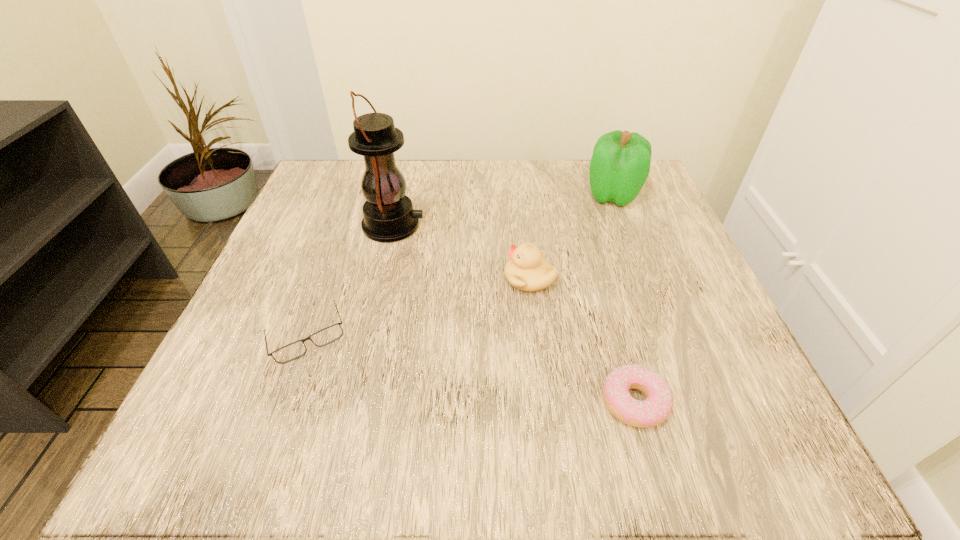
Locate an element on the screen. object that is the second nearest to the third nearest object is located at coordinates (388, 216).

At what (x,y) coordinates should I click in order to perform the action: click on vacant region that satisfies the following two spatial constraints: 1. above the lantern, indicating its light source; 2. with the lenses facing outward on the spectacles. Please return your answer as a coordinate pair (x, y). Image resolution: width=960 pixels, height=540 pixels. Looking at the image, I should click on (368, 336).

At what (x,y) coordinates should I click in order to perform the action: click on free space that satisfies the following two spatial constraints: 1. on the beak of the third nearest object; 2. on the right side of the doughnut. Please return your answer as a coordinate pair (x, y). The image size is (960, 540). Looking at the image, I should click on (543, 402).

Image resolution: width=960 pixels, height=540 pixels. In order to click on free spot that satisfies the following two spatial constraints: 1. above the nearest object, indicating its light source; 2. on the right side of the lantern in this screenshot , I will do `click(352, 402)`.

Identify the location of free space in the image that satisfies the following two spatial constraints: 1. above the lantern, indicating its light source; 2. on the left side of the nearest object. (352, 402).

At what (x,y) coordinates should I click in order to perform the action: click on free spot that satisfies the following two spatial constraints: 1. on the back side of the nearest object; 2. on the beak of the third shortest object. Please return your answer as a coordinate pair (x, y). Looking at the image, I should click on (600, 279).

Where is `vacant space that satisfies the following two spatial constraints: 1. on the beak of the third shortest object; 2. on the back side of the doughnut`? The image size is (960, 540). vacant space that satisfies the following two spatial constraints: 1. on the beak of the third shortest object; 2. on the back side of the doughnut is located at coordinates (543, 402).

This screenshot has width=960, height=540. I want to click on free location that satisfies the following two spatial constraints: 1. above the tallest object, indicating its light source; 2. with the lenses facing outward on the spectacles, so click(x=368, y=336).

Where is `vacant point that satisfies the following two spatial constraints: 1. on the beak of the third tallest object; 2. on the right side of the nearest object`? The image size is (960, 540). vacant point that satisfies the following two spatial constraints: 1. on the beak of the third tallest object; 2. on the right side of the nearest object is located at coordinates (543, 402).